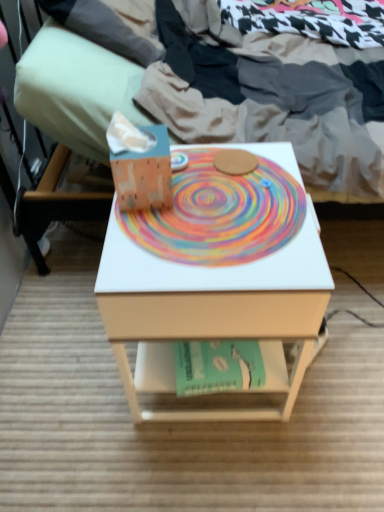
Where is `rainbow painted paper at center`? The height and width of the screenshot is (512, 384). rainbow painted paper at center is located at coordinates (220, 214).

Could you tell me if teal paper at center is turned towards rainbow painted paper at center?

No, teal paper at center is not aimed at rainbow painted paper at center.

From a real-world perspective, is teal paper at center positioned above or below rainbow painted paper at center?

In terms of real-world spatial position, teal paper at center is below rainbow painted paper at center.

Considering the positions of objects teal paper at center and rainbow painted paper at center in the image provided, who is behind, teal paper at center or rainbow painted paper at center?

teal paper at center is further away from the camera.

Find the location of a particular element. pillow behind the teal paper at center is located at coordinates (75, 89).

From a real-world perspective, which object stands above the other?

matte green pillow at upper left.

Does point (209, 346) come farther from viewer compared to point (68, 98)?

No, it is not.

Does teal paper at center touch matte green pillow at upper left?

There is a gap between teal paper at center and matte green pillow at upper left.

Considering the sizes of objects white matte desk at center and rainbow painted paper at center in the image provided, who is bigger, white matte desk at center or rainbow painted paper at center?

white matte desk at center is bigger.

Considering the positions of objects white matte desk at center and rainbow painted paper at center in the image provided, who is in front, white matte desk at center or rainbow painted paper at center?

white matte desk at center is closer to the camera.

From a real-world perspective, is white matte desk at center physically below rainbow painted paper at center?

Yes, from a real-world perspective, white matte desk at center is beneath rainbow painted paper at center.

The image size is (384, 512). I want to click on mandala located above the white matte desk at center (from a real-world perspective), so click(x=220, y=214).

Consider the image. Can we say matte green pillow at upper left lies outside rainbow painted paper at center?

Yes, matte green pillow at upper left is not within rainbow painted paper at center.

You are a GUI agent. You are given a task and a screenshot of the screen. Output one action in this format:
    pyautogui.click(x=<x>, y=<y>)
    Task: Click on the mandala lying on the right of matte green pillow at upper left
    
    Given the screenshot: What is the action you would take?
    pyautogui.click(x=220, y=214)

In the scene shown: Is matte green pillow at upper left taller or shorter than rainbow painted paper at center?

Considering their sizes, matte green pillow at upper left has more height than rainbow painted paper at center.

Between matte green pillow at upper left and rainbow painted paper at center, which one has larger size?

Bigger between the two is matte green pillow at upper left.

In the image, is rainbow painted paper at center positioned in front of or behind white matte desk at center?

Visually, rainbow painted paper at center is located behind white matte desk at center.

Is rainbow painted paper at center located outside white matte desk at center?

No, rainbow painted paper at center is inside or overlapping with white matte desk at center.

Identify the location of mandala located above the white matte desk at center (from the image's perspective). This screenshot has width=384, height=512. (220, 214).

Would you consider white matte desk at center to be distant from matte green pillow at upper left?

No, there isn't a large distance between white matte desk at center and matte green pillow at upper left.

From a real-world perspective, which object rests below the other?

In real-world perspective, white matte desk at center is lower.

Is white matte desk at center aimed at matte green pillow at upper left?

No, white matte desk at center is not turned towards matte green pillow at upper left.

Between point (287, 327) and point (72, 140), which one is positioned in front?

The point (287, 327) is closer.

This screenshot has height=512, width=384. I want to click on desk in front of the matte white bed at center, so click(x=216, y=268).

From the image's perspective, is matte white bed at center over white matte desk at center?

Yes, from the image's perspective, matte white bed at center is over white matte desk at center.

Which point is more distant from viewer, (183, 83) or (270, 244)?

Positioned behind is point (183, 83).

In the scene shown: Which is more to the right, matte white bed at center or white matte desk at center?

Positioned to the right is matte white bed at center.

Identify the location of paperback book on the right of rainbow painted paper at center. The image size is (384, 512). (229, 366).

The height and width of the screenshot is (512, 384). What are the coordinates of `pillow lying on the left of teal paper at center` in the screenshot? It's located at (75, 89).

From the image, which object appears to be farther from matte white bed at center, matte green pillow at upper left or rainbow painted paper at center?

rainbow painted paper at center.

Considering their positions, is teal paper at center positioned further to matte orange tissue box at center than white matte desk at center?

teal paper at center is further to matte orange tissue box at center.

Considering their positions, is matte green pillow at upper left positioned further to matte white bed at center than white matte desk at center?

white matte desk at center.

Which object lies further to the anchor point matte orange tissue box at center, teal paper at center or matte green pillow at upper left?

teal paper at center.

From the picture: When comparing their distances from matte white bed at center, does teal paper at center or matte green pillow at upper left seem further?

teal paper at center.

Based on their spatial positions, is rainbow painted paper at center or teal paper at center further from matte white bed at center?

teal paper at center lies further to matte white bed at center than the other object.

Which object lies nearer to the anchor point matte green pillow at upper left, rainbow painted paper at center or white matte desk at center?

Among the two, rainbow painted paper at center is located nearer to matte green pillow at upper left.

Based on their spatial positions, is white matte desk at center or matte green pillow at upper left further from matte white bed at center?

white matte desk at center is further to matte white bed at center.

Image resolution: width=384 pixels, height=512 pixels. What are the coordinates of `pillow between matte white bed at center and matte orange tissue box at center vertically` in the screenshot? It's located at (75, 89).

At what (x,y) coordinates should I click in order to perform the action: click on pillow between matte white bed at center and teal paper at center vertically. Please return your answer as a coordinate pair (x, y). The width and height of the screenshot is (384, 512). Looking at the image, I should click on (75, 89).

You are a GUI agent. You are given a task and a screenshot of the screen. Output one action in this format:
    pyautogui.click(x=<x>, y=<y>)
    Task: Click on the desk between rainbow painted paper at center and teal paper at center vertically
    The width and height of the screenshot is (384, 512).
    Given the screenshot: What is the action you would take?
    pyautogui.click(x=216, y=268)

Image resolution: width=384 pixels, height=512 pixels. What are the coordinates of `box between matte green pillow at upper left and rainbow painted paper at center in the up-down direction` in the screenshot? It's located at (144, 174).